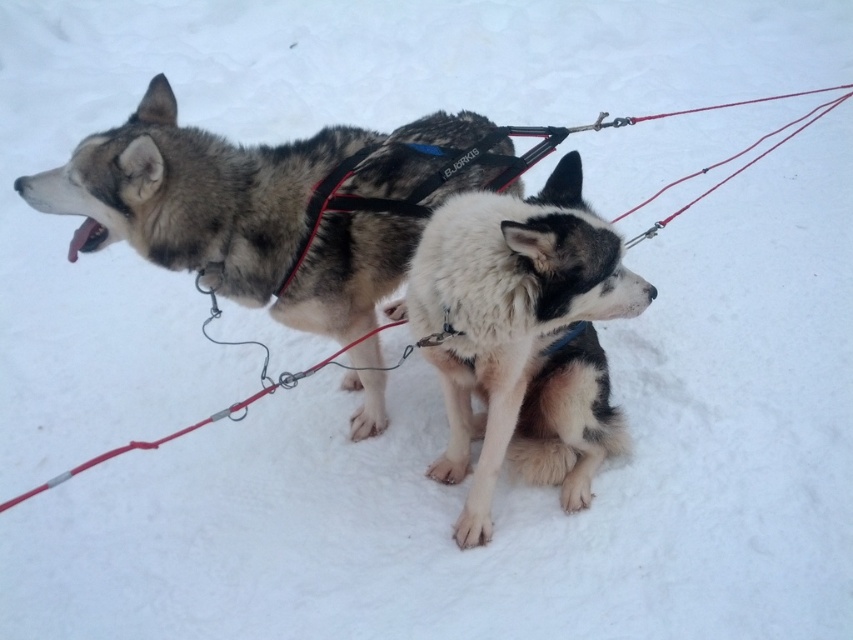
Question: Does dark gray fur at center come behind fuzzy white fur at center?

Choices:
 (A) yes
 (B) no

Answer: (A)

Question: Which point is closer to the camera?

Choices:
 (A) fuzzy white fur at center
 (B) dark gray fur at center

Answer: (A)

Question: Does dark gray fur at center appear under fuzzy white fur at center?

Choices:
 (A) yes
 (B) no

Answer: (B)

Question: Is dark gray fur at center wider than fuzzy white fur at center?

Choices:
 (A) no
 (B) yes

Answer: (B)